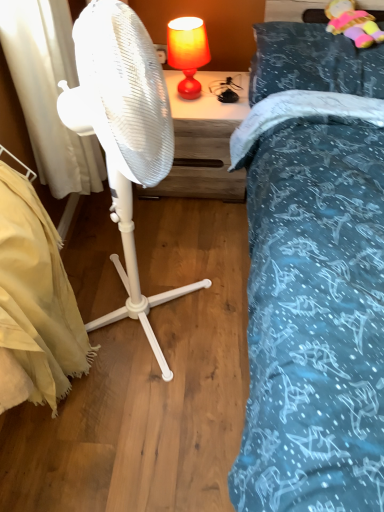
What are the coordinates of `free region under matte orange lampshade at upper center (from a real-world perspective)` in the screenshot? It's located at click(190, 103).